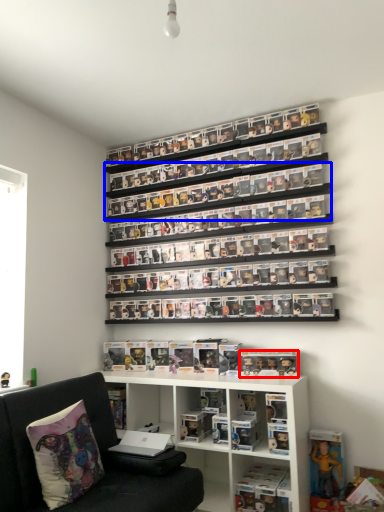
Question: Which object is further to the camera taking this photo, toy (highlighted by a red box) or shelf (highlighted by a blue box)?

Choices:
 (A) toy
 (B) shelf

Answer: (B)